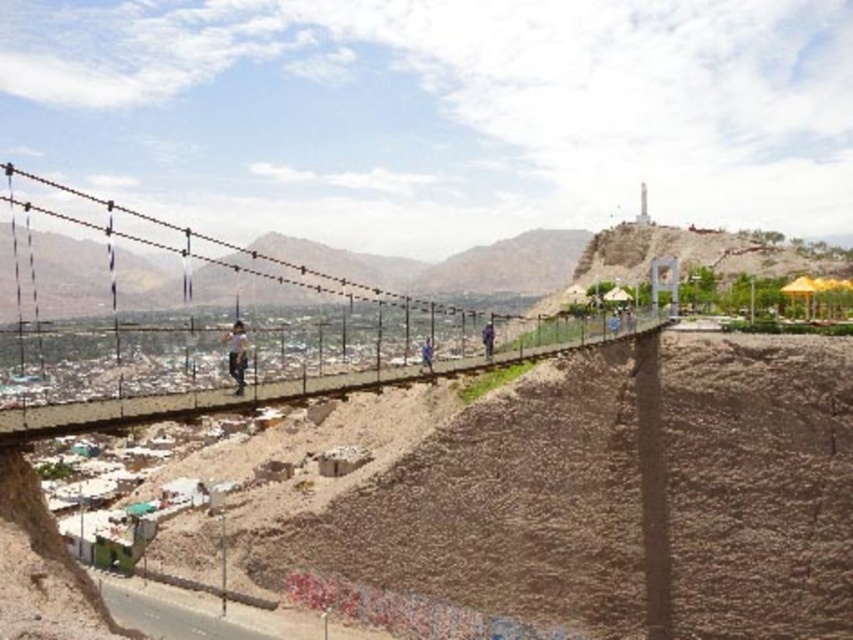
Between brown sandy dirt track at center and blue fabric person at center, which one is positioned lower?

brown sandy dirt track at center

Find the location of `brown sandy dirt track at center`. brown sandy dirt track at center is located at coordinates (621, 497).

Where is `brown sandy dirt track at center`? The width and height of the screenshot is (853, 640). brown sandy dirt track at center is located at coordinates (621, 497).

Between brown sandy dirt track at center and dark blue jeans at center, which one appears on the left side from the viewer's perspective?

brown sandy dirt track at center

Looking at this image, is brown sandy dirt track at center closer to camera compared to dark blue jeans at center?

Yes, brown sandy dirt track at center is in front of dark blue jeans at center.

Who is more forward, (566,358) or (486,339)?

Point (486,339)

You are a GUI agent. You are given a task and a screenshot of the screen. Output one action in this format:
    pyautogui.click(x=<x>, y=<y>)
    Task: Click on the brown sandy dirt track at center
    This screenshot has width=853, height=640.
    Given the screenshot: What is the action you would take?
    pyautogui.click(x=621, y=497)

Between point (424, 340) and point (492, 352), which one is positioned behind?

The point (424, 340) is more distant.

How much distance is there between blue fabric person at center and dark blue jeans at center?

blue fabric person at center is 31.94 meters away from dark blue jeans at center.

Is point (425, 348) in front of point (488, 346)?

That is True.

At what (x,y) coordinates should I click in order to perform the action: click on blue fabric person at center. Please return your answer as a coordinate pair (x, y). This screenshot has width=853, height=640. Looking at the image, I should click on (426, 355).